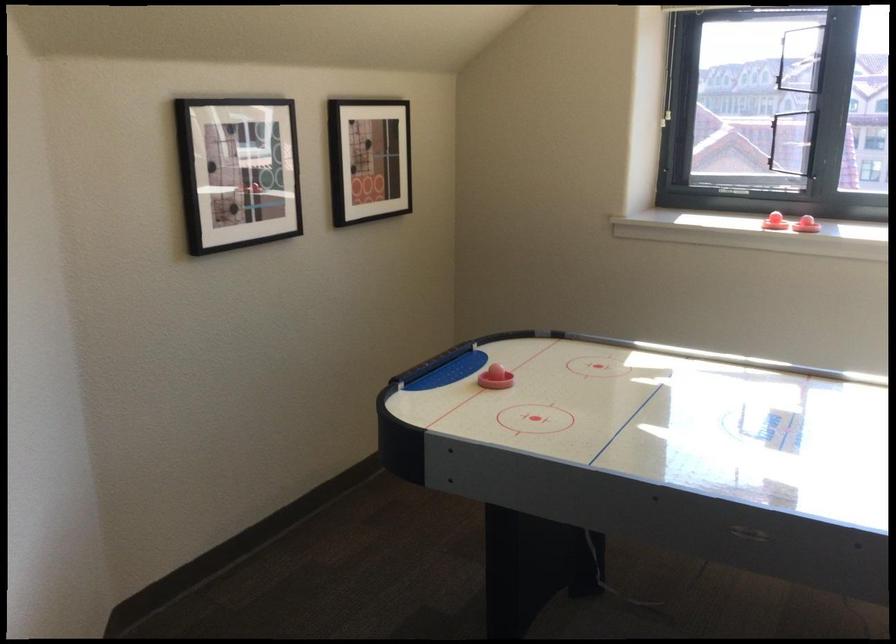
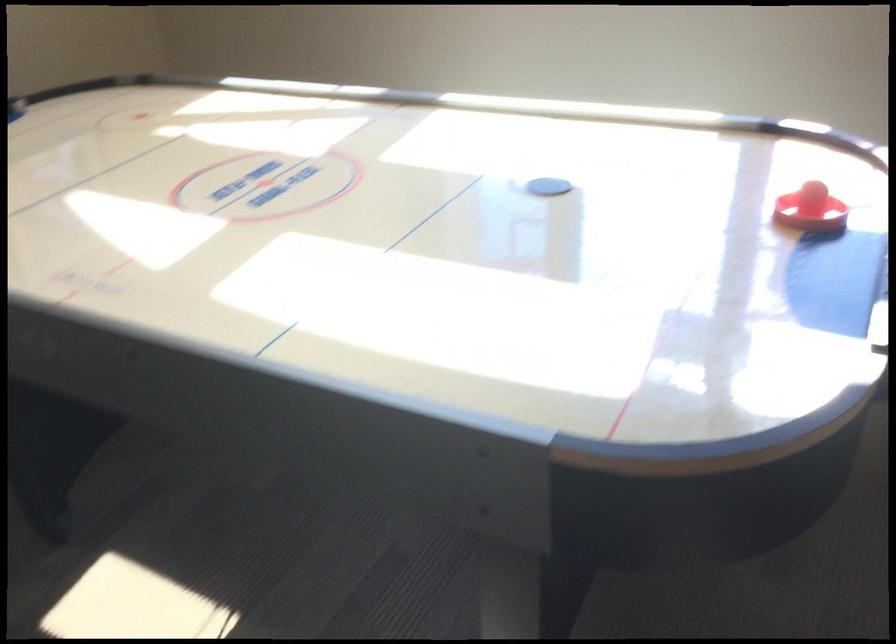
The images are taken continuously from a first-person perspective. In which direction are you moving?

The movement direction of the cameraman is right, forward.